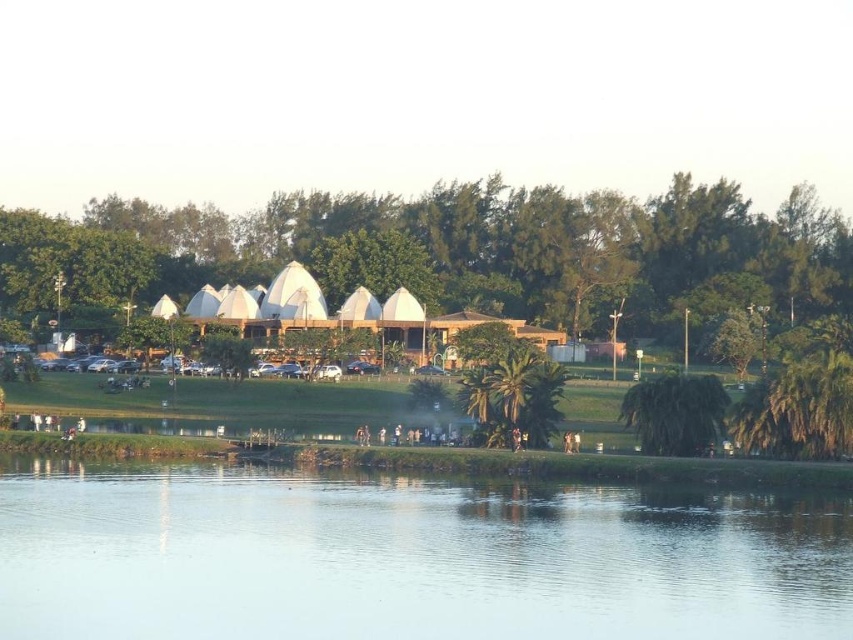
Question: Does green leafy palm tree at center appear over green leafy tree at lower right?

Choices:
 (A) no
 (B) yes

Answer: (B)

Question: Which object appears closest to the camera in this image?

Choices:
 (A) transparent water at center
 (B) green leafy tree at center

Answer: (A)

Question: Is transparent water at center smaller than green leafy tree at center?

Choices:
 (A) yes
 (B) no

Answer: (A)

Question: Which point is farther from the camera taking this photo?

Choices:
 (A) (77, 586)
 (B) (556, 392)
 (C) (643, 428)

Answer: (B)

Question: Estimate the real-world distances between objects in this image. Which object is closer to the green leafy tree at lower right?

Choices:
 (A) green leafy tree at center
 (B) transparent water at center

Answer: (B)

Question: Is green leafy tree at center above green leafy palm tree at center?

Choices:
 (A) no
 (B) yes

Answer: (B)